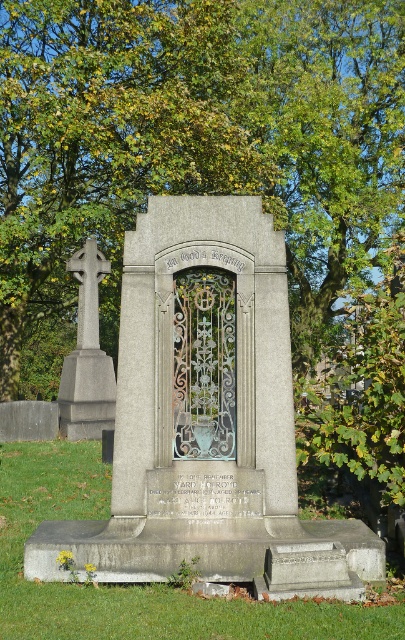
Question: Does gray stone monument at center come behind polished stone cross at left?

Choices:
 (A) yes
 (B) no

Answer: (B)

Question: Which point is closer to the camera taking this photo?

Choices:
 (A) (98, 257)
 (B) (234, 330)

Answer: (B)

Question: Which point appears closest to the camera in this image?

Choices:
 (A) (294, 209)
 (B) (80, 275)
 (C) (223, 474)

Answer: (C)

Question: Can you confirm if green leafy tree at upper center is thinner than polished stone cross at left?

Choices:
 (A) no
 (B) yes

Answer: (A)

Question: Which point is farther to the camera?

Choices:
 (A) (78, 244)
 (B) (102, 272)

Answer: (A)

Question: Can you confirm if green leafy tree at upper center is wider than polished stone cross at left?

Choices:
 (A) no
 (B) yes

Answer: (B)